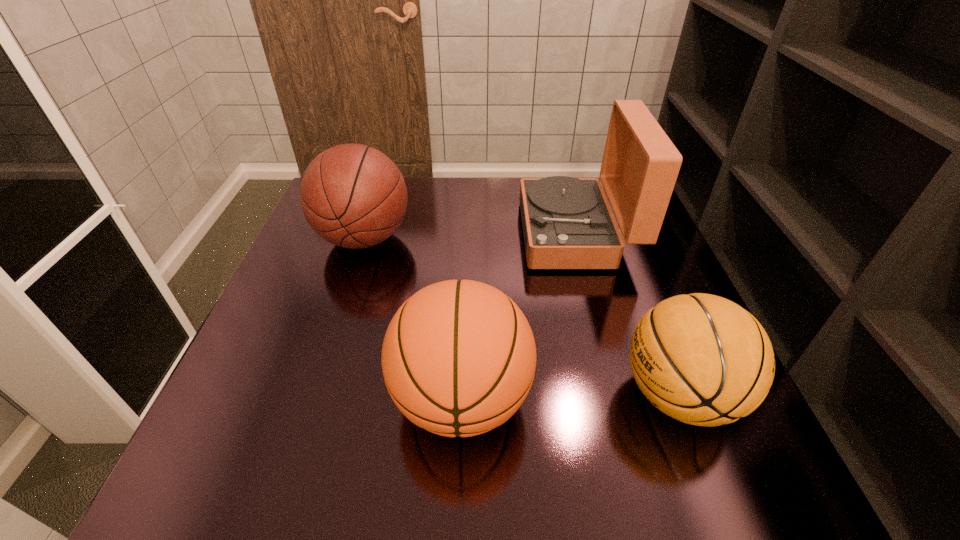
Where is `object that is at the far right corner`? object that is at the far right corner is located at coordinates (567, 222).

This screenshot has height=540, width=960. Find the location of `object at the near right corner`. object at the near right corner is located at coordinates click(702, 359).

Find the location of a particular element. This screenshot has height=540, width=960. vacant space at the far edge of the desktop is located at coordinates (465, 177).

The image size is (960, 540). In the image, there is a desktop. Find the location of `vacant space at the near edge`. vacant space at the near edge is located at coordinates (334, 442).

Where is `free space at the left edge of the desktop`? free space at the left edge of the desktop is located at coordinates (306, 298).

Identify the location of vacant space at the right edge. (653, 246).

Locate an element on the screen. The width and height of the screenshot is (960, 540). vacant point at the near left corner is located at coordinates (190, 456).

Find the location of a particular element. This screenshot has width=960, height=540. free space that is in between the farthest basketball and the tallest object is located at coordinates (470, 236).

Where is `vacant space that's between the shortest basketball and the tallest object`? Image resolution: width=960 pixels, height=540 pixels. vacant space that's between the shortest basketball and the tallest object is located at coordinates pos(628,314).

Find the location of `object that stands as the closest to the shortest basketball`. object that stands as the closest to the shortest basketball is located at coordinates (458, 358).